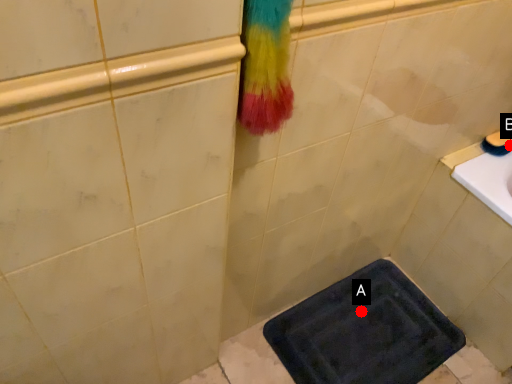
Question: Two points are circled on the image, labeled by A and B beside each circle. Among these points, which one is nearest to the camera?

Choices:
 (A) A is closer
 (B) B is closer

Answer: (B)